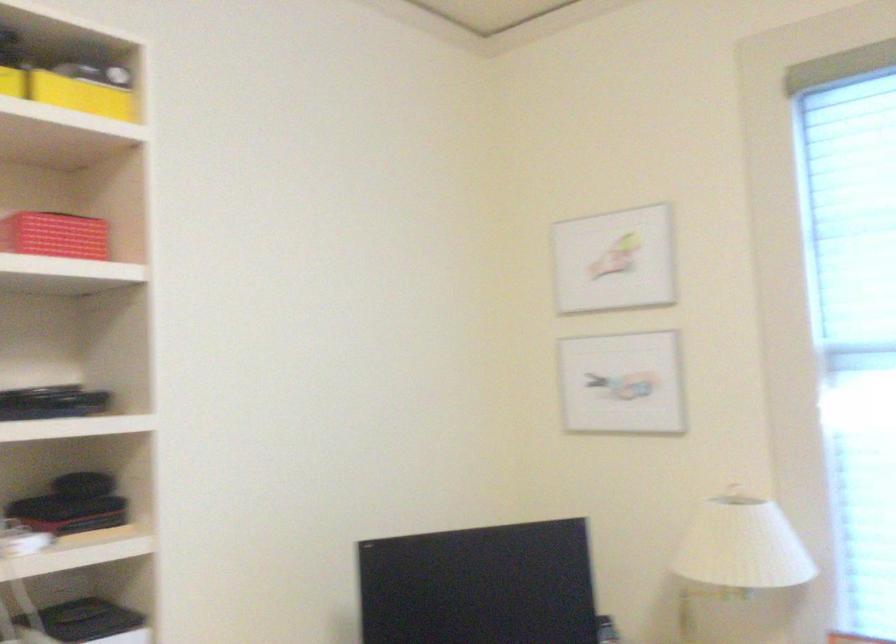
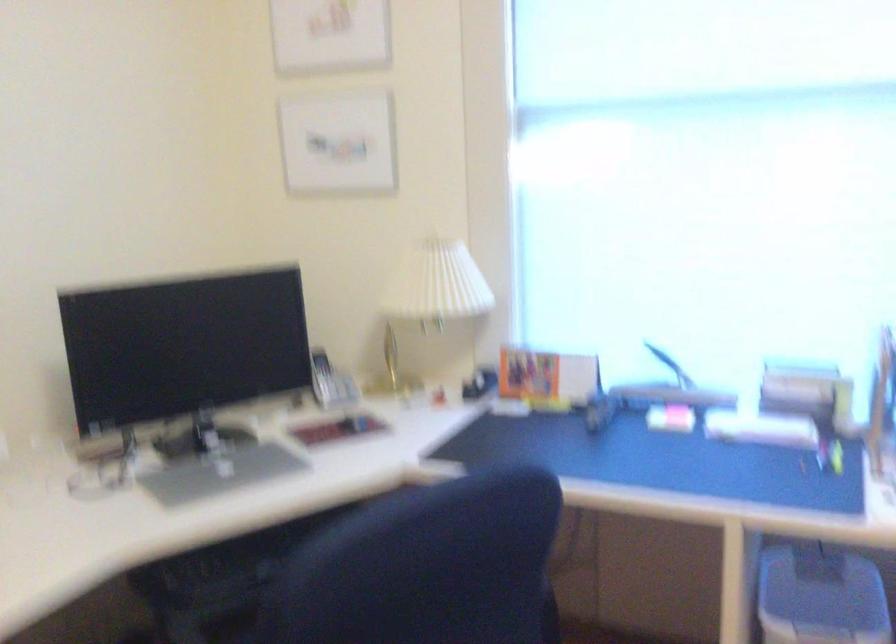
The point at (x=737, y=563) is marked in the first image. Where is the corresponding point in the second image?

(433, 295)